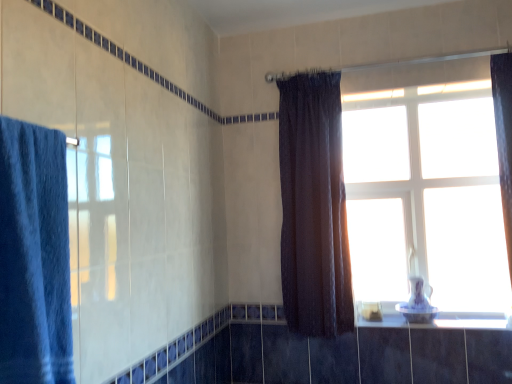
Question: Considering the positions of dark brown sheer curtain at center, the 2th curtain positioned from the left, and blue fabric towel at left, which is the 1th curtain from front to back, in the image, is dark brown sheer curtain at center, the 2th curtain positioned from the left, bigger or smaller than blue fabric towel at left, which is the 1th curtain from front to back,?

Choices:
 (A) small
 (B) big

Answer: (B)

Question: Which is correct: dark brown sheer curtain at center, which is the 1th curtain from back to front, is inside blue fabric towel at left, the 2th curtain in the back-to-front sequence, or outside of it?

Choices:
 (A) inside
 (B) outside

Answer: (B)

Question: Which object is the farthest from the white glossy window sill at lower right?

Choices:
 (A) blue fabric towel at left, the 2th curtain in the back-to-front sequence
 (B) dark brown sheer curtain at center, the 2th curtain positioned from the left
 (C) white glass window at upper right

Answer: (A)

Question: Estimate the real-world distances between objects in this image. Which object is farther from the white glass window at upper right?

Choices:
 (A) dark brown sheer curtain at center, which is the 1th curtain from back to front
 (B) blue fabric towel at left, the 2th curtain in the back-to-front sequence
 (C) white glossy window sill at lower right

Answer: (B)